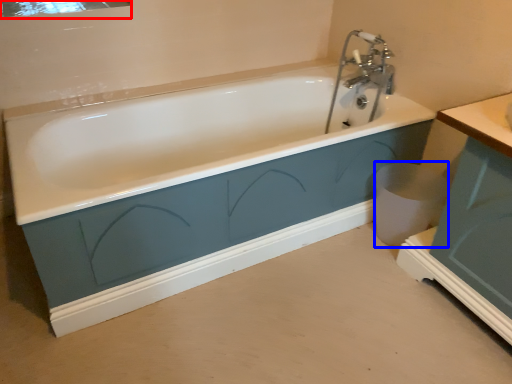
Question: Which object appears closest to the camera in this image, mirror (highlighted by a red box) or toilet bowl (highlighted by a blue box)?

Choices:
 (A) mirror
 (B) toilet bowl

Answer: (A)